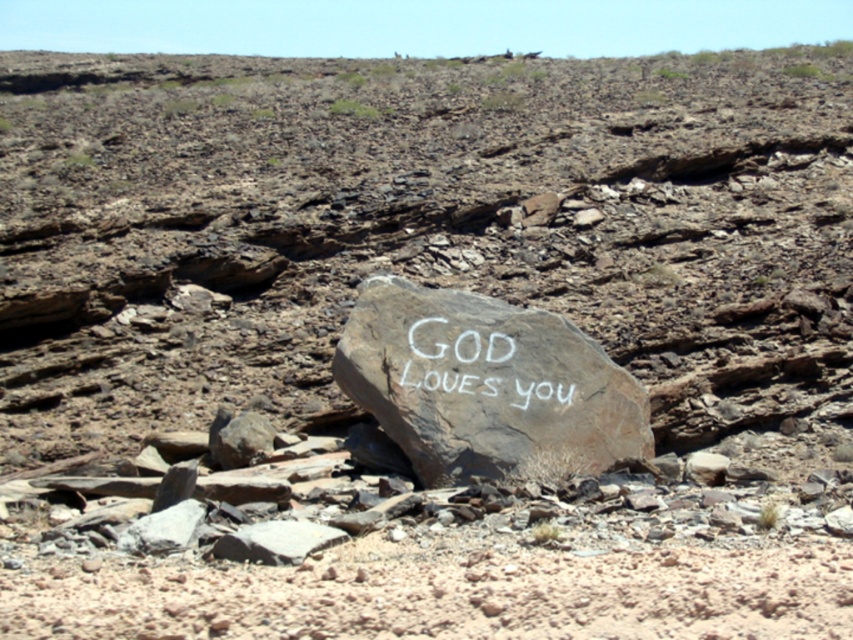
Question: Which of the following is the closest to the observer?

Choices:
 (A) natural stone boulder at center
 (B) white chalk writing at center

Answer: (A)

Question: Is natural stone boulder at center thinner than white chalk writing at center?

Choices:
 (A) no
 (B) yes

Answer: (A)

Question: Does natural stone boulder at center come in front of white chalk writing at center?

Choices:
 (A) yes
 (B) no

Answer: (A)

Question: Which object appears closest to the camera in this image?

Choices:
 (A) white chalk writing at center
 (B) natural stone boulder at center

Answer: (B)

Question: Can you confirm if natural stone boulder at center is smaller than white chalk writing at center?

Choices:
 (A) no
 (B) yes

Answer: (A)